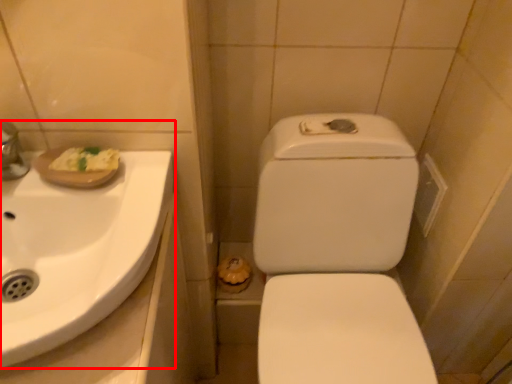
Question: From the image's perspective, what is the correct spatial relationship of sink (annotated by the red box) in relation to toilet?

Choices:
 (A) below
 (B) above

Answer: (B)